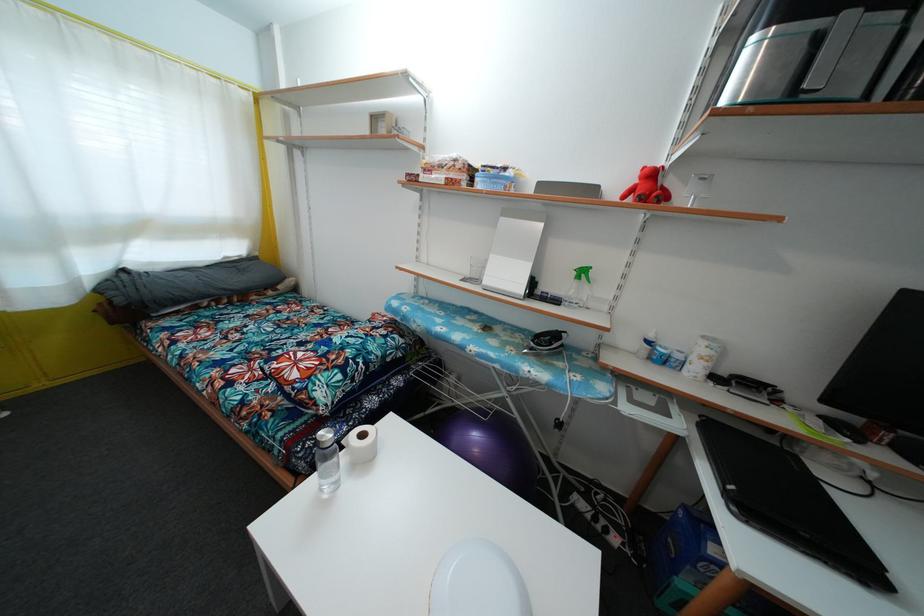
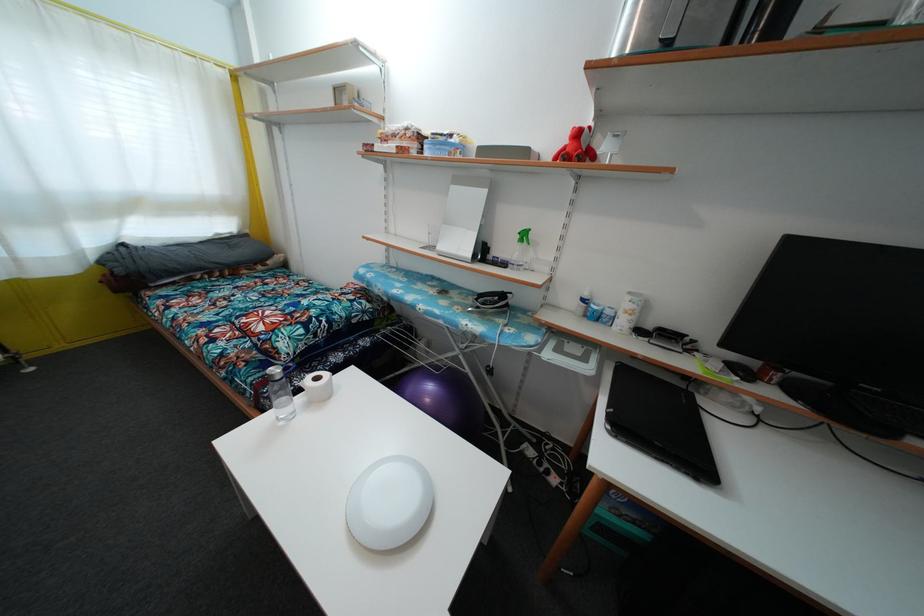
In the second image, find the point that corresponds to pixel 540 212 in the first image.

(488, 177)